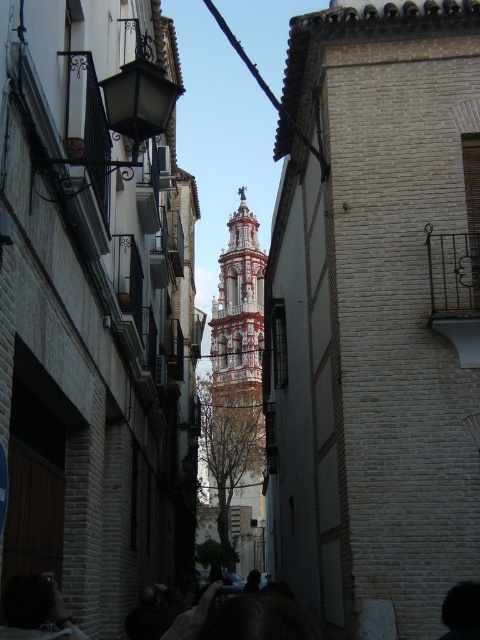
Question: Which point is closer to the camera?

Choices:
 (A) (239, 257)
 (B) (458, 634)

Answer: (B)

Question: Can you confirm if white painted brick bell tower at center is positioned above dark hair at lower right?

Choices:
 (A) no
 (B) yes

Answer: (B)

Question: Does white painted brick bell tower at center have a larger size compared to dark hair at lower right?

Choices:
 (A) no
 (B) yes

Answer: (B)

Question: Which of these objects is positioned farthest from the white painted brick bell tower at center?

Choices:
 (A) dark hair at lower right
 (B) dark brown hair at lower left

Answer: (A)

Question: Can you confirm if white painted brick bell tower at center is positioned to the right of dark brown hair at lower left?

Choices:
 (A) yes
 (B) no

Answer: (A)

Question: Which point is farther to the camera?

Choices:
 (A) (45, 579)
 (B) (242, 196)

Answer: (B)